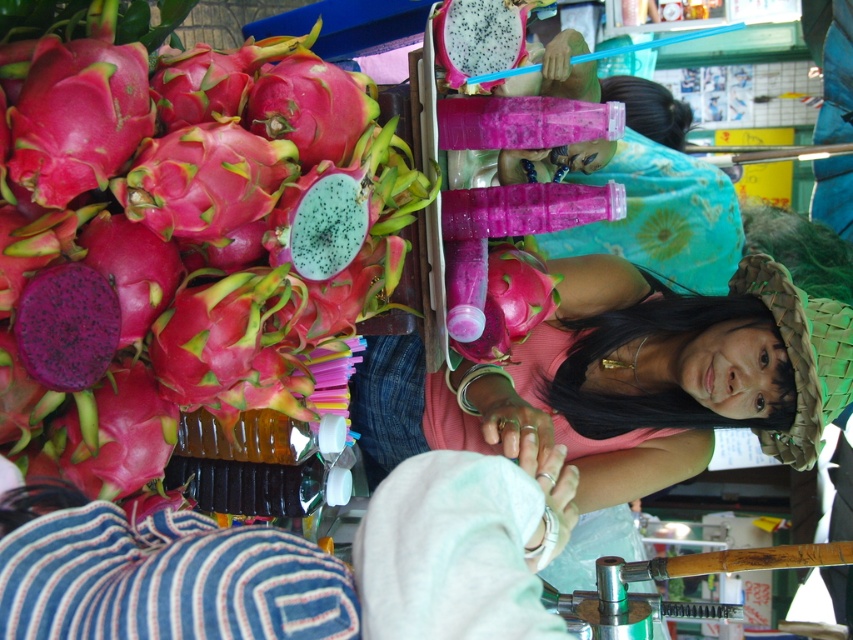
Is pink matte dragonfruit at upper left thinner than pink matte dragon fruit at center?

Indeed, pink matte dragonfruit at upper left has a lesser width compared to pink matte dragon fruit at center.

Who is more forward, [126,444] or [392,467]?

Positioned in front is point [126,444].

This screenshot has height=640, width=853. Describe the element at coordinates (186, 246) in the screenshot. I see `pink matte dragonfruit at upper left` at that location.

The height and width of the screenshot is (640, 853). I want to click on pink matte dragonfruit at upper left, so click(186, 246).

Can you confirm if pink matte dragon fruit at left is thinner than pink matte dragon fruit at center?

Yes.

Which is behind, point (277, 586) or point (550, 388)?

The point (550, 388) is behind.

The image size is (853, 640). Identify the location of pink matte dragon fruit at left. (294, 564).

Locate an element on the screen. Image resolution: width=853 pixels, height=640 pixels. pink matte dragon fruit at left is located at coordinates (294, 564).

Between pink matte dragonfruit at upper left and pink matte dragon fruit at left, which one has more height?

pink matte dragonfruit at upper left

Looking at this image, is pink matte dragonfruit at upper left to the left of pink matte dragon fruit at left from the viewer's perspective?

Indeed, pink matte dragonfruit at upper left is positioned on the left side of pink matte dragon fruit at left.

Where is `pink matte dragonfruit at upper left`? The image size is (853, 640). pink matte dragonfruit at upper left is located at coordinates (186, 246).